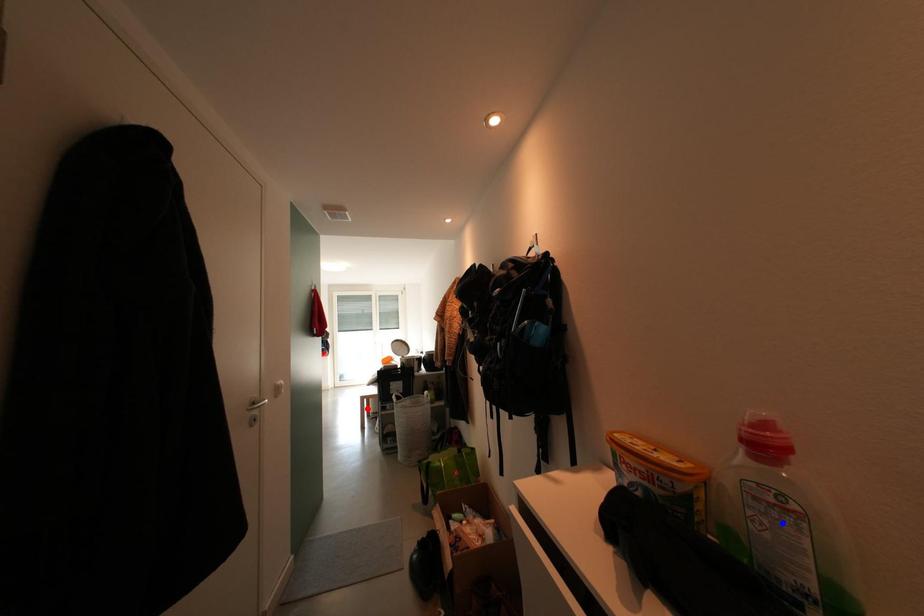
Question: Which of the two points in the image is closer to the camera?

Choices:
 (A) Blue point is closer.
 (B) Red point is closer.

Answer: (A)